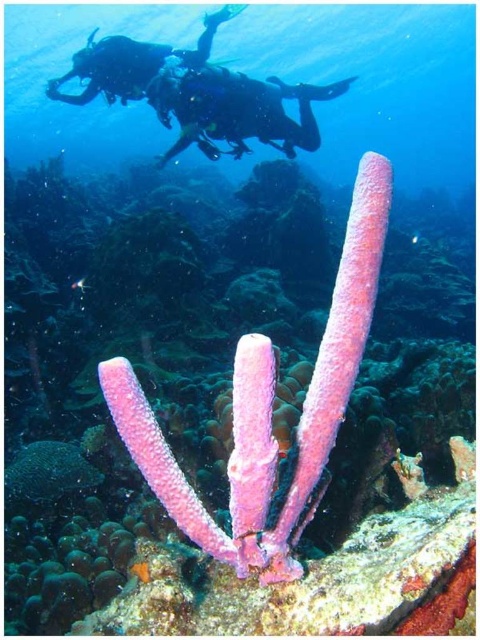
Question: Among these objects, which one is nearest to the camera?

Choices:
 (A) matte black scuba diver at upper center
 (B) pink sponge at center

Answer: (B)

Question: Does pink sponge at center come in front of matte black scuba diver at upper left?

Choices:
 (A) no
 (B) yes

Answer: (B)

Question: Which object is positioned farthest from the pink sponge at center?

Choices:
 (A) matte black scuba diver at upper center
 (B) matte black scuba diver at upper left

Answer: (B)

Question: Which of the following is the farthest from the observer?

Choices:
 (A) pink sponge at center
 (B) matte black scuba diver at upper center

Answer: (B)

Question: Does pink sponge at center have a larger size compared to matte black scuba diver at upper left?

Choices:
 (A) no
 (B) yes

Answer: (B)

Question: Does pink sponge at center have a lesser width compared to matte black scuba diver at upper center?

Choices:
 (A) yes
 (B) no

Answer: (B)